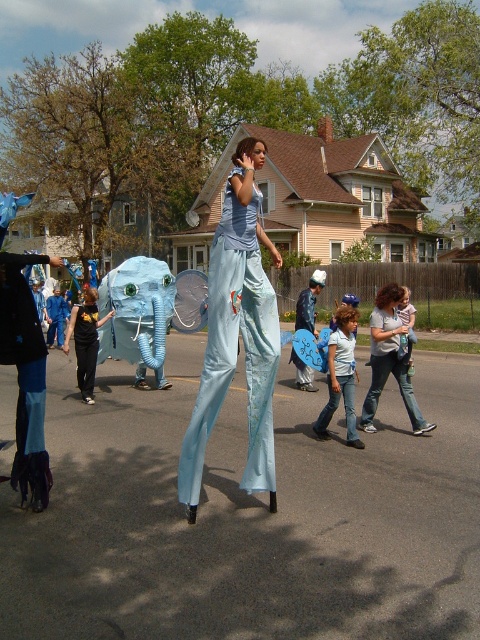
You are a photographer capturing the lively street scene. You notice a point marked at coordinates (x=235, y=369). What object is located at that specific point?

The point at coordinates (x=235, y=369) marks the light blue fabric pants at center.

You are standing at the origin point in the image and want to move towards the blue jeans at center. Which direction should you move in terms of the coordinate system provided?

The blue jeans at center is located at point 0.589 on the x and 0.710 on the y axis. Since the origin is at the bottom left corner, you should move to the right and upwards to reach it.